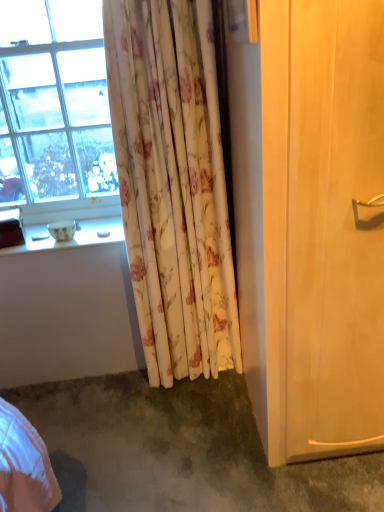
Question: Relative to white glossy bowl at lower left, is light wood screen door at right in front or behind?

Choices:
 (A) front
 (B) behind

Answer: (A)

Question: Based on their positions, is light wood screen door at right located to the left or right of white glossy bowl at lower left?

Choices:
 (A) left
 (B) right

Answer: (B)

Question: Considering the real-world distances, which object is closest to the gray carpet at lower left?

Choices:
 (A) transparent glass window at upper left
 (B) white glossy bowl at lower left
 (C) light wood screen door at right
 (D) white glossy window sill at lower left
 (E) floral fabric curtain at center

Answer: (E)

Question: Based on their relative distances, which object is nearer to the white glossy bowl at lower left?

Choices:
 (A) transparent glass window at upper left
 (B) floral fabric curtain at center
 (C) light wood screen door at right
 (D) gray carpet at lower left
 (E) white glossy window sill at lower left

Answer: (E)